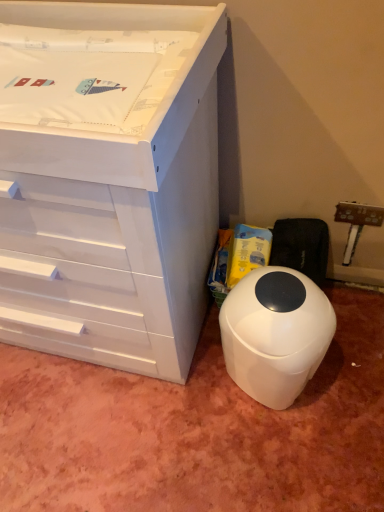
Where is `free space to the left of white plastic waste bin at lower right`? Image resolution: width=384 pixels, height=512 pixels. free space to the left of white plastic waste bin at lower right is located at coordinates (190, 397).